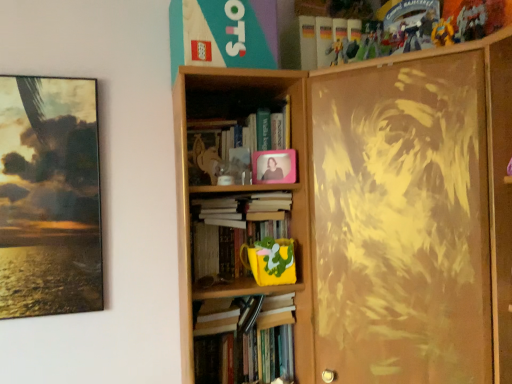
Find the location of a particular element. The width and height of the screenshot is (512, 384). blank space above pink matte photo frame at upper center, placed as the third book when sorted from bottom to top (from a real-world perspective) is located at coordinates (236, 106).